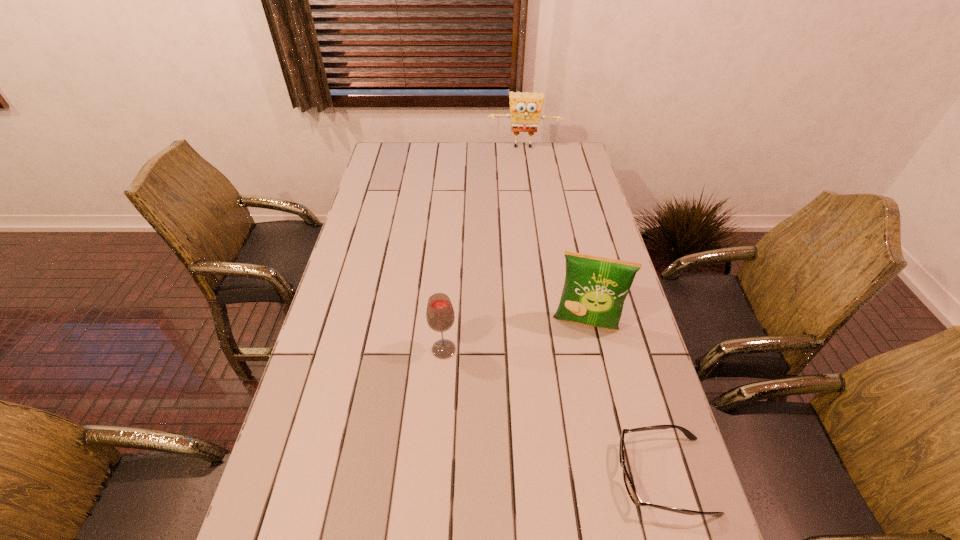
Locate an element on the screen. free location that satisfies the following two spatial constraints: 1. on the front side of the farthest object; 2. on the front-facing side of the shortest object is located at coordinates (569, 475).

The height and width of the screenshot is (540, 960). Find the location of `free location that satisfies the following two spatial constraints: 1. on the back side of the crisp (potato chip); 2. on the right side of the leftmost object`. free location that satisfies the following two spatial constraints: 1. on the back side of the crisp (potato chip); 2. on the right side of the leftmost object is located at coordinates (445, 325).

Image resolution: width=960 pixels, height=540 pixels. Find the location of `free space that satisfies the following two spatial constraints: 1. on the front side of the second shortest object; 2. on the front-facing side of the nearest object`. free space that satisfies the following two spatial constraints: 1. on the front side of the second shortest object; 2. on the front-facing side of the nearest object is located at coordinates (435, 475).